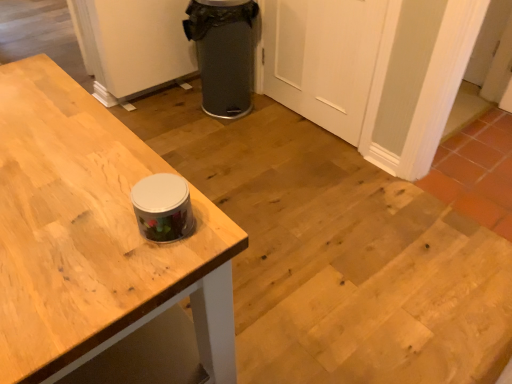
Where is `vacant space situated above wooden table at upper left (from a real-world perspective)`? vacant space situated above wooden table at upper left (from a real-world perspective) is located at coordinates (55, 172).